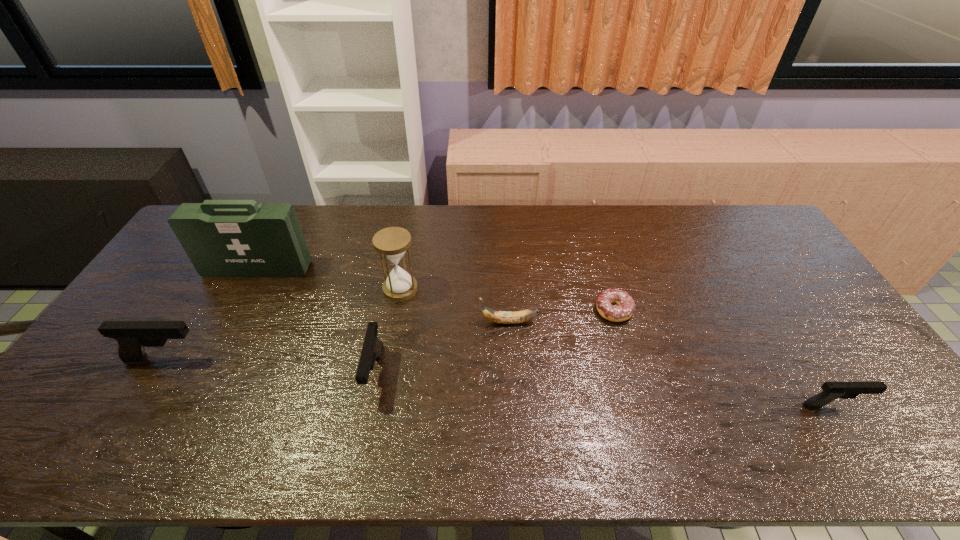
Find the location of a particular element. This screenshot has height=540, width=960. the first-aid kit located at the left edge is located at coordinates (223, 238).

The width and height of the screenshot is (960, 540). Find the location of `object present at the right edge`. object present at the right edge is located at coordinates pos(831,391).

Identify the location of object present at the near right corner. (831, 391).

This screenshot has width=960, height=540. In the image, there is a desktop. Identify the location of vacant area at the far edge. (304, 217).

In order to click on blank space at the near edge in this screenshot , I will do click(331, 410).

Locate an element on the screen. The width and height of the screenshot is (960, 540). vacant space at the right edge is located at coordinates 766,251.

This screenshot has height=540, width=960. Find the location of `free space at the near left corner of the desktop`. free space at the near left corner of the desktop is located at coordinates (82, 412).

At what (x,y) coordinates should I click in order to perform the action: click on vacant space at the far right corner. Please return your answer as a coordinate pair (x, y). This screenshot has width=960, height=540. Looking at the image, I should click on (761, 232).

Find the location of a particular element. free space between the fifth object from left to right and the tallest pistol is located at coordinates (337, 340).

Locate an element on the screen. empty space between the second tallest pistol and the tallest object is located at coordinates (316, 321).